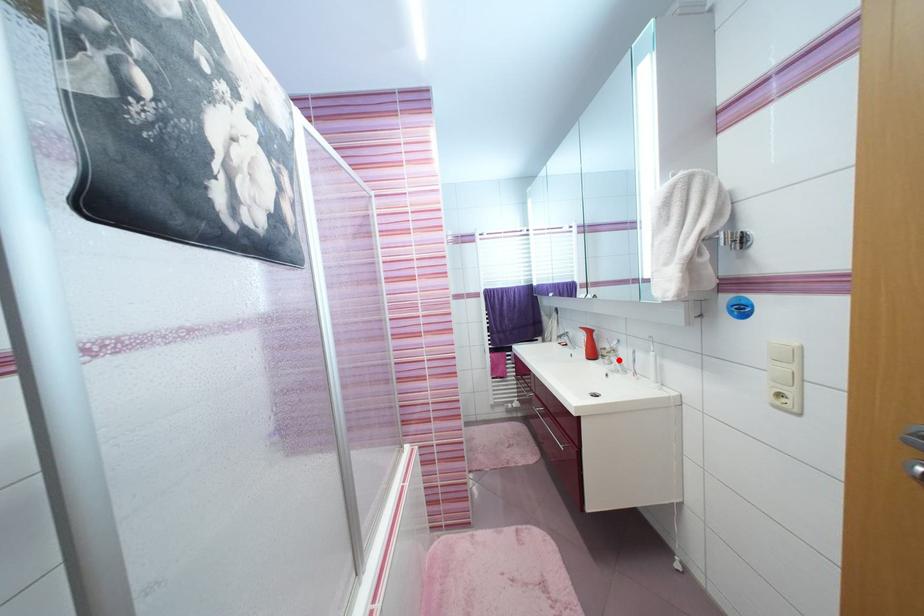
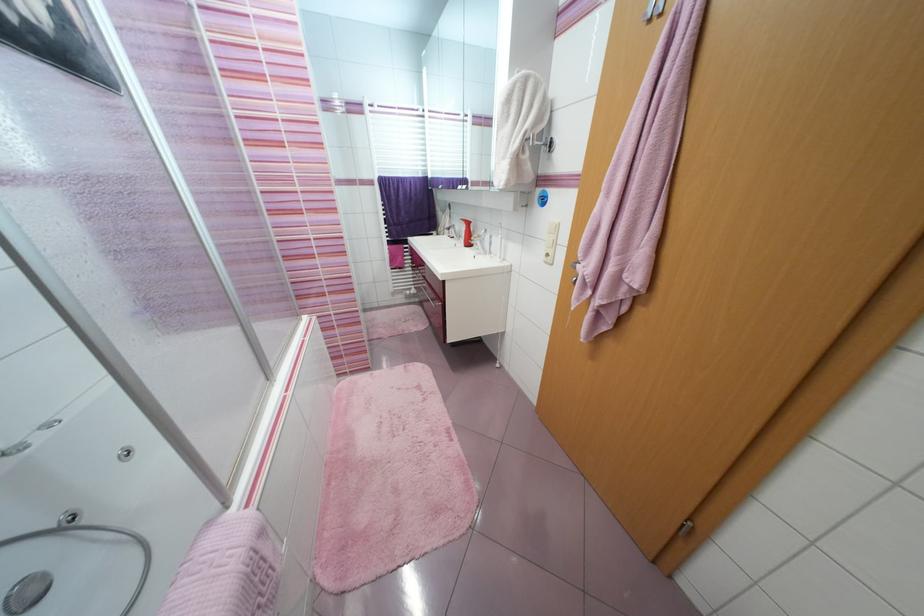
Question: I am providing you with two images of the same scene from different viewpoints. In image1, a red point is highlighted. Considering the same 3D point in image2, which of the following is correct?

Choices:
 (A) It is closer
 (B) It is farther

Answer: (A)